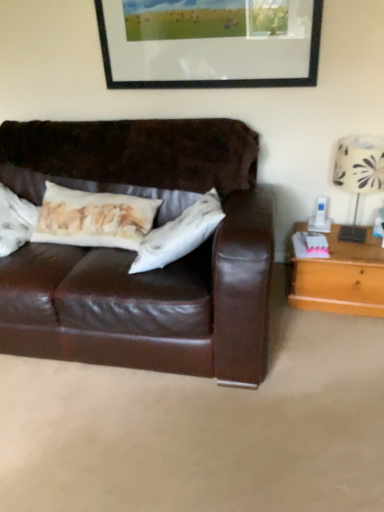
I want to click on vacant space situated on the left part of light brown wooden table at right, so click(286, 308).